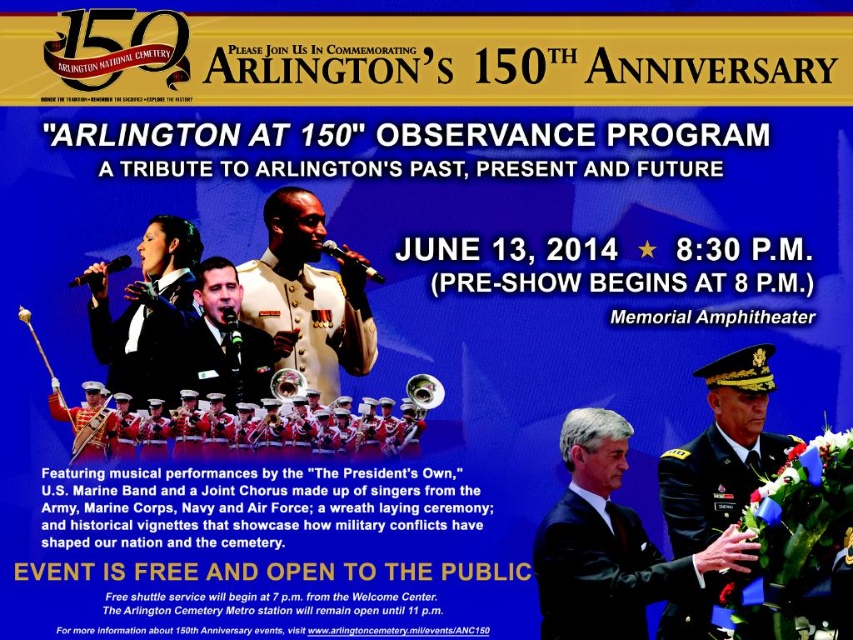
What is the relationship between the sizes of the black uniform at center and the shiny black suit at left in the poster?

The black uniform at center is larger in size compared to the shiny black suit at left.

You are an event planner reviewing the promotional poster for the Arlington at 150 observance program. You notice two central elements, the shiny black uniform at center and the shiny gold trumpet at center. Based on their positions, which one is placed higher on the poster?

The shiny black uniform at center is located above the shiny gold trumpet at center, so it is placed higher on the poster.

What is located at the point with coordinates (146, 339) on the poster?

A shiny black suit at left is located at point (146, 339).